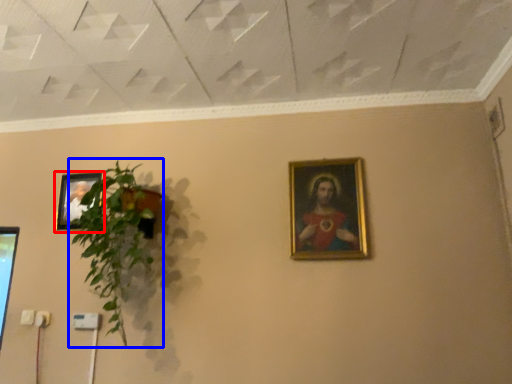
Question: Among these objects, which one is farthest to the camera, picture frame (highlighted by a red box) or houseplant (highlighted by a blue box)?

Choices:
 (A) picture frame
 (B) houseplant

Answer: (A)